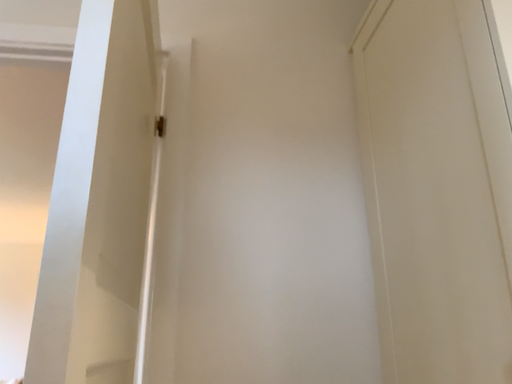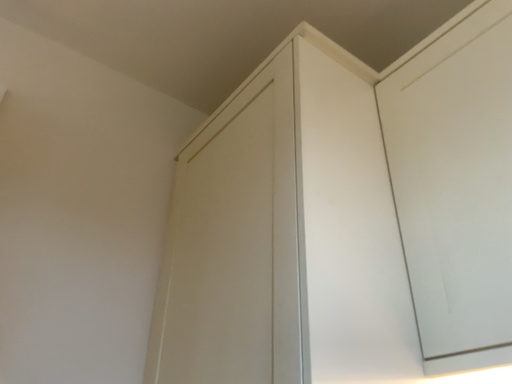
Question: Which way did the camera rotate in the video?

Choices:
 (A) rotated downward
 (B) rotated upward

Answer: (B)